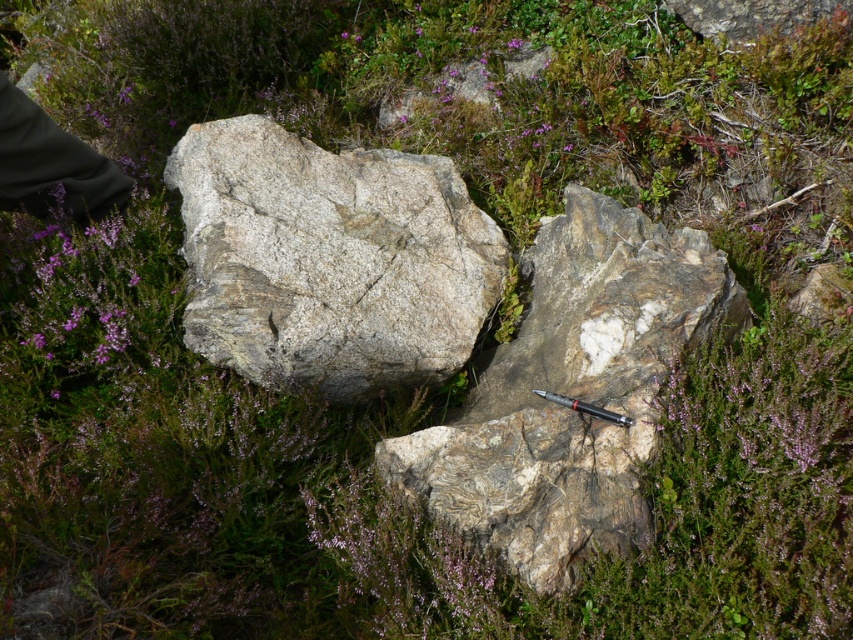
Between granite rock at center and black metallic pen at center, which one has more height?

With more height is granite rock at center.

Who is positioned more to the right, granite rock at center or black metallic pen at center?

Positioned to the right is granite rock at center.

This screenshot has width=853, height=640. Find the location of `granite rock at center`. granite rock at center is located at coordinates (572, 392).

Where is `granite rock at center`? This screenshot has height=640, width=853. granite rock at center is located at coordinates (572, 392).

Who is more forward, (260,260) or (25,141)?

Positioned in front is point (260,260).

Describe the element at coordinates (329, 259) in the screenshot. This screenshot has width=853, height=640. I see `gray granite boulder at center` at that location.

What do you see at coordinates (329, 259) in the screenshot?
I see `gray granite boulder at center` at bounding box center [329, 259].

At what (x,y) coordinates should I click in order to perform the action: click on gray granite boulder at center. Please return your answer as a coordinate pair (x, y). Looking at the image, I should click on (329, 259).

Between gray granite boulder at center and granite rock at center, which one is positioned higher?

Positioned higher is gray granite boulder at center.

Is gray granite boulder at center positioned behind granite rock at center?

Yes, it is.

Locate an element on the screen. This screenshot has width=853, height=640. gray granite boulder at center is located at coordinates (329, 259).